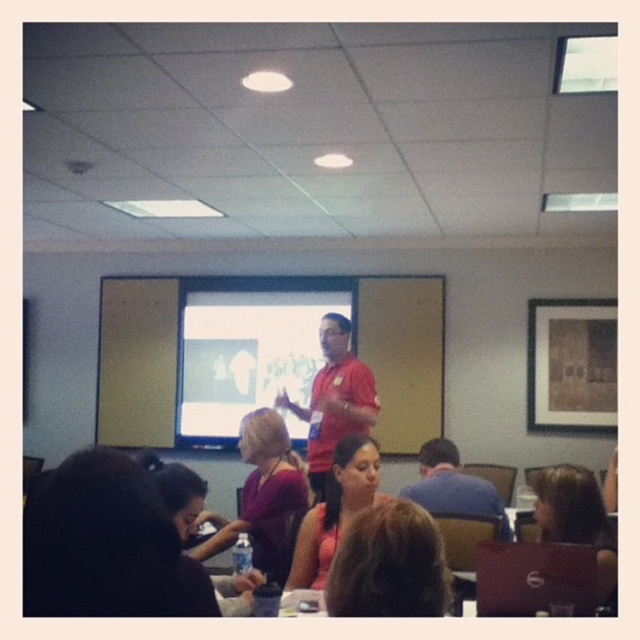
Question: Based on their relative distances, which object is farther from the red matte shirt at center?

Choices:
 (A) matte pink shirt at center
 (B) blue shirt at center
 (C) white glossy projection screen at center
 (D) brown hair at lower right

Answer: (C)

Question: Observing the image, what is the correct spatial positioning of red matte shirt at center in reference to matte pink shirt at center?

Choices:
 (A) right
 (B) left

Answer: (B)

Question: Does matte pink shirt at center appear on the right side of brown hair at lower right?

Choices:
 (A) yes
 (B) no

Answer: (B)

Question: Is red matte shirt at center closer to the viewer compared to brown hair at lower right?

Choices:
 (A) no
 (B) yes

Answer: (A)

Question: Which point is farther from the camera taking this photo?

Choices:
 (A) (550, 483)
 (B) (365, 403)
 (C) (264, 410)

Answer: (B)

Question: Which of these objects is positioned farthest from the brown hair at lower right?

Choices:
 (A) white glossy projection screen at center
 (B) matte purple blouse at center
 (C) matte pink shirt at center

Answer: (A)